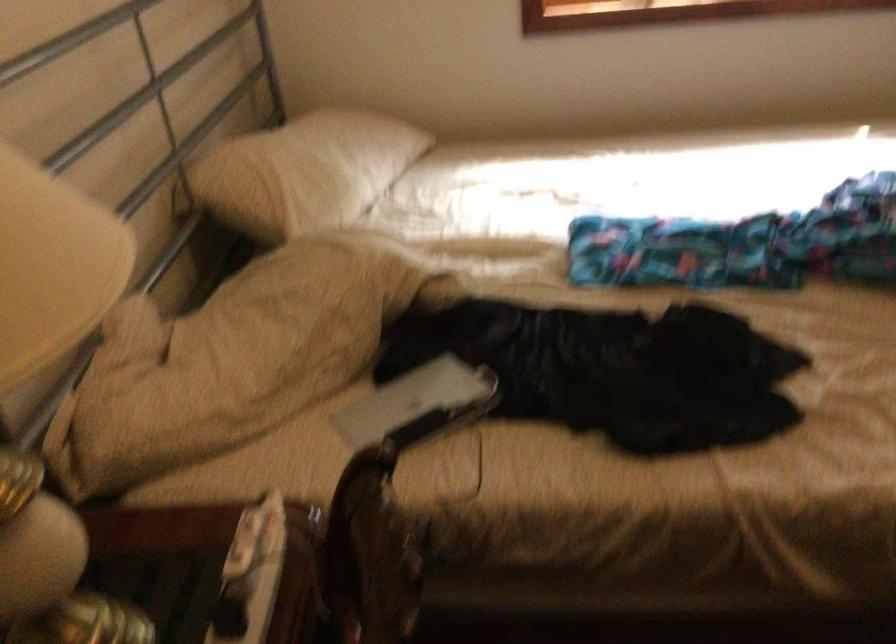
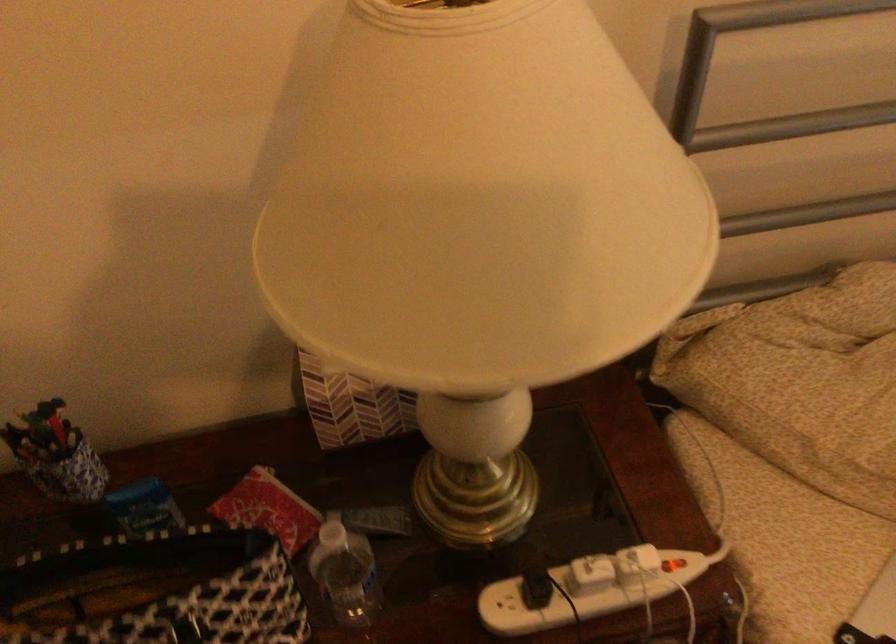
The images are taken continuously from a first-person perspective. In which direction is your viewpoint rotating?

The camera rotated toward left-down.